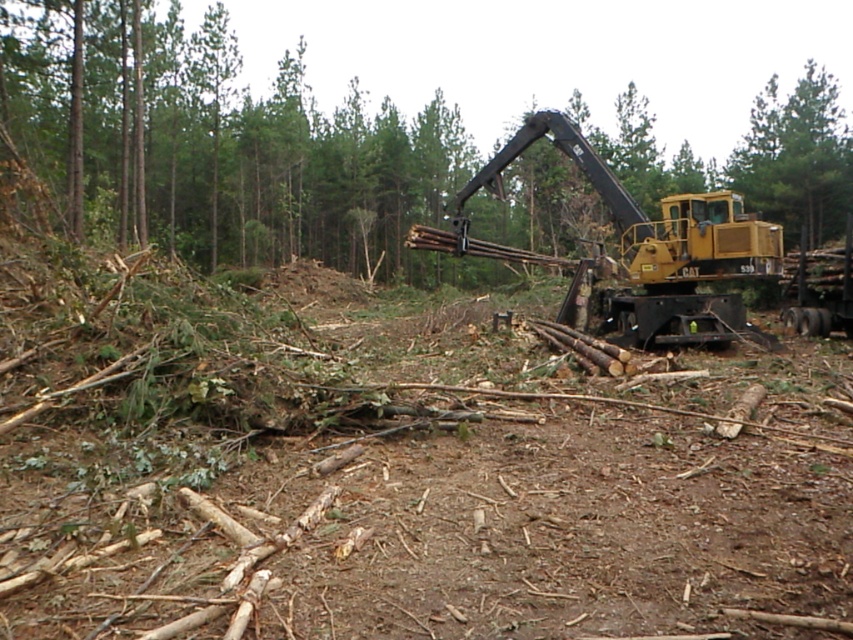
This screenshot has height=640, width=853. I want to click on green leafy tree at center, so click(x=215, y=141).

Is point (160, 93) closer to camera compared to point (604, 266)?

No, (160, 93) is further to viewer.

Is point (363, 225) positioned before point (616, 305)?

No.

Find the location of `green leafy tree at center`. green leafy tree at center is located at coordinates (215, 141).

Between yellow metallic excavator at right and green rough bark tree at upper right, which one appears on the right side from the viewer's perspective?

From the viewer's perspective, green rough bark tree at upper right appears more on the right side.

Who is taller, yellow metallic excavator at right or green rough bark tree at upper right?

green rough bark tree at upper right is taller.

At what (x,y) coordinates should I click in order to perform the action: click on yellow metallic excavator at right. Please return your answer as a coordinate pair (x, y). The height and width of the screenshot is (640, 853). Looking at the image, I should click on (636, 250).

Between point (25, 118) and point (767, 115), which one is positioned behind?

Positioned behind is point (767, 115).

Between point (80, 88) and point (840, 168), which one is positioned in front?

Positioned in front is point (80, 88).

Is point (166, 188) farther from camera compared to point (827, 234)?

Yes.

This screenshot has width=853, height=640. Find the location of `green leafy tree at center`. green leafy tree at center is located at coordinates (215, 141).